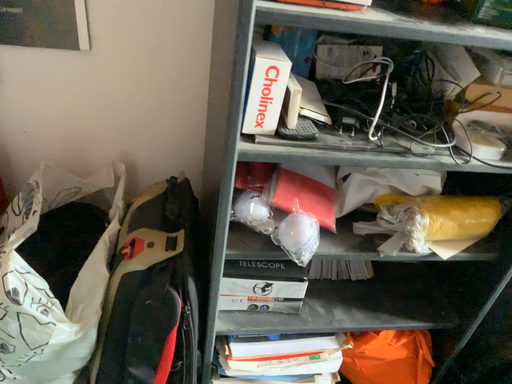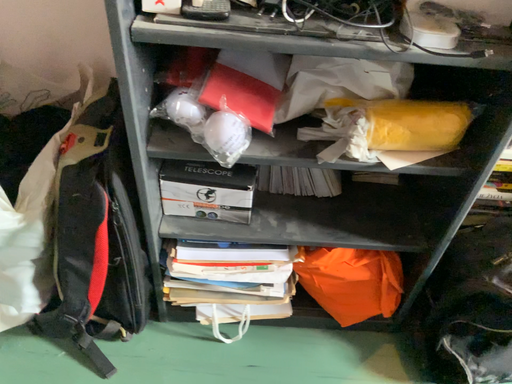
Question: Which way did the camera rotate in the video?

Choices:
 (A) rotated left
 (B) rotated right

Answer: (A)